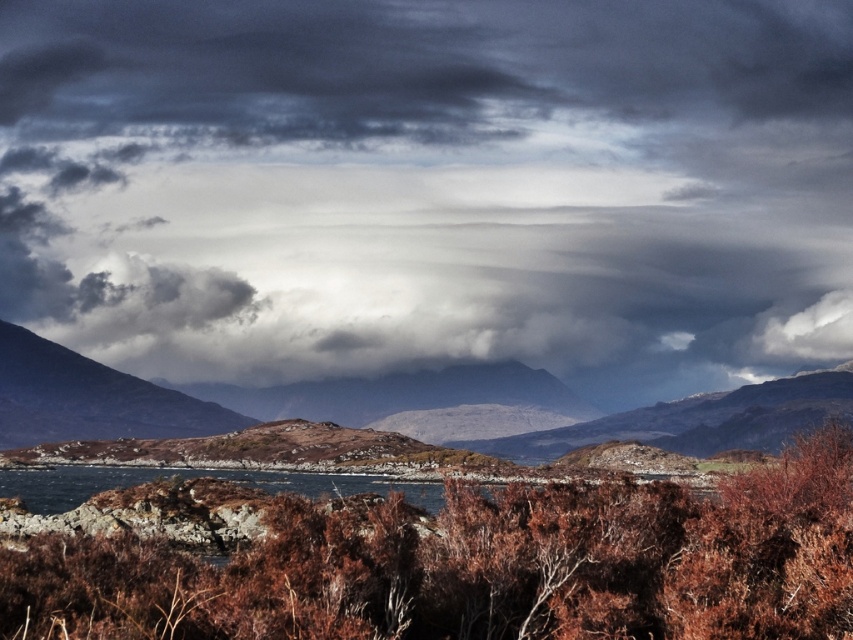
Question: Does brown shrubbery at center appear over rugged brown mountain at left?

Choices:
 (A) no
 (B) yes

Answer: (B)

Question: Which object is farther from the camera taking this photo?

Choices:
 (A) rugged brown mountain at left
 (B) brown rocky mountain at center
 (C) brown shrubbery at center
 (D) dark gray cloud at upper center

Answer: (D)

Question: Is brown rocky mountain at center further to the viewer compared to rugged brown mountain at left?

Choices:
 (A) no
 (B) yes

Answer: (A)

Question: Can you confirm if dark gray cloud at upper center is bigger than brown shrubbery at center?

Choices:
 (A) no
 (B) yes

Answer: (B)

Question: Which point appears farthest from the camera in this image?

Choices:
 (A) (276, 378)
 (B) (90, 381)
 (C) (16, 369)

Answer: (A)

Question: Which object is farther from the camera taking this photo?

Choices:
 (A) dark gray cloud at upper center
 (B) brown shrubbery at center
 (C) rugged brown mountain at left

Answer: (A)